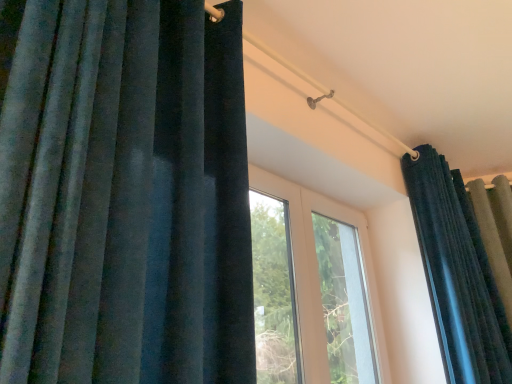
Identify the location of velvet dark blue curtain at left, which ranks as the 1th curtain in left-to-right order. (125, 196).

Image resolution: width=512 pixels, height=384 pixels. What do you see at coordinates (125, 196) in the screenshot? I see `velvet dark blue curtain at left, which is counted as the second curtain, starting from the right` at bounding box center [125, 196].

The image size is (512, 384). In order to click on transparent glass window at center in this screenshot , I will do `click(344, 303)`.

From a real-world perspective, is transparent glass window at center physically below velvet dark blue curtain at left, which is counted as the second curtain, starting from the right?

Yes, from a real-world perspective, transparent glass window at center is under velvet dark blue curtain at left, which is counted as the second curtain, starting from the right.

Which is in front, point (356, 234) or point (26, 68)?

The point (26, 68) is more forward.

Does transparent glass window at center lie in front of velvet dark blue curtain at left, which ranks as the 1th curtain in left-to-right order?

No.

Based on their sizes in the image, would you say transparent glass window at center is bigger or smaller than velvet dark blue curtain at left, arranged as the 2th curtain when viewed from the back?

In the image, transparent glass window at center appears to be smaller than velvet dark blue curtain at left, arranged as the 2th curtain when viewed from the back.

Is velvet dark blue curtain at left, which ranks as the 1th curtain in left-to-right order, positioned in front of velvet dark blue curtain at upper right, which appears as the second curtain when viewed from the front?

Yes, velvet dark blue curtain at left, which ranks as the 1th curtain in left-to-right order, is closer to the viewer.

Between velvet dark blue curtain at left, acting as the 1th curtain starting from the front, and velvet dark blue curtain at upper right, the first curtain positioned from the back, which one has more height?

With more height is velvet dark blue curtain at upper right, the first curtain positioned from the back.

From a real-world perspective, between velvet dark blue curtain at left, which is counted as the second curtain, starting from the right, and velvet dark blue curtain at upper right, which appears as the second curtain when viewed from the front, who is vertically higher?

In real-world perspective, velvet dark blue curtain at left, which is counted as the second curtain, starting from the right, is above.

Which point is more forward, (197, 64) or (506, 341)?

The point (197, 64) is more forward.

Does point (168, 26) come behind point (353, 266)?

No.

Consider the image. From the image's perspective, which one is positioned higher, velvet dark blue curtain at left, arranged as the 2th curtain when viewed from the back, or transparent glass window at center?

velvet dark blue curtain at left, arranged as the 2th curtain when viewed from the back.

Between velvet dark blue curtain at left, acting as the 1th curtain starting from the front, and transparent glass window at center, which one has less height?

transparent glass window at center.

Does velvet dark blue curtain at left, acting as the 1th curtain starting from the front, have a larger size compared to transparent glass window at center?

Yes, velvet dark blue curtain at left, acting as the 1th curtain starting from the front, is bigger than transparent glass window at center.

Which of these two, velvet dark blue curtain at upper right, the first curtain positioned from the back, or velvet dark blue curtain at left, which ranks as the 1th curtain in left-to-right order, stands shorter?

Standing shorter between the two is velvet dark blue curtain at left, which ranks as the 1th curtain in left-to-right order.

In the scene shown: Which object is thinner, velvet dark blue curtain at upper right, the first curtain positioned from the back, or velvet dark blue curtain at left, acting as the 1th curtain starting from the front?

velvet dark blue curtain at left, acting as the 1th curtain starting from the front, is thinner.

Does point (454, 213) lie behind point (9, 173)?

Yes, point (454, 213) is farther from viewer.

Identify the location of curtain that appears on the left of velvet dark blue curtain at upper right, the first curtain positioned from the back. (x=125, y=196).

Considering the positions of point (370, 376) and point (440, 182), is point (370, 376) closer or farther from the camera than point (440, 182)?

Point (370, 376) is positioned closer to the camera compared to point (440, 182).

Who is more distant, transparent glass window at center or velvet dark blue curtain at upper right, positioned as the 2th curtain in left-to-right order?

transparent glass window at center.

Visually, is transparent glass window at center positioned to the left or to the right of velvet dark blue curtain at upper right, which appears as the first curtain when viewed from the right?

From the image, it's evident that transparent glass window at center is to the left of velvet dark blue curtain at upper right, which appears as the first curtain when viewed from the right.

Considering the sizes of objects velvet dark blue curtain at upper right, which appears as the second curtain when viewed from the front, and transparent glass window at center in the image provided, who is thinner, velvet dark blue curtain at upper right, which appears as the second curtain when viewed from the front, or transparent glass window at center?

transparent glass window at center.

Locate an element on the screen. window on the left of the velvet dark blue curtain at upper right, which appears as the second curtain when viewed from the front is located at coordinates (344, 303).

Which of these two, velvet dark blue curtain at upper right, the first curtain positioned from the back, or transparent glass window at center, stands taller?

Standing taller between the two is velvet dark blue curtain at upper right, the first curtain positioned from the back.

Is velvet dark blue curtain at upper right, positioned as the 2th curtain in left-to-right order, positioned far away from transparent glass window at center?

They are positioned close to each other.

Find the location of a particular element. This screenshot has width=512, height=384. curtain that is the 2nd object located in front of the transparent glass window at center is located at coordinates (125, 196).

Identify the location of curtain lying behind the velvet dark blue curtain at left, arranged as the 2th curtain when viewed from the back. (457, 273).

From the image, which object appears to be nearer to transparent glass window at center, velvet dark blue curtain at upper right, which appears as the second curtain when viewed from the front, or velvet dark blue curtain at left, which ranks as the 1th curtain in left-to-right order?

The object closer to transparent glass window at center is velvet dark blue curtain at upper right, which appears as the second curtain when viewed from the front.

Looking at the image, which one is located further to transparent glass window at center, velvet dark blue curtain at left, which ranks as the 1th curtain in left-to-right order, or velvet dark blue curtain at upper right, the first curtain positioned from the back?

velvet dark blue curtain at left, which ranks as the 1th curtain in left-to-right order, lies further to transparent glass window at center than the other object.

When comparing their distances from velvet dark blue curtain at upper right, which appears as the second curtain when viewed from the front, does velvet dark blue curtain at left, arranged as the 2th curtain when viewed from the back, or transparent glass window at center seem further?

Among the two, velvet dark blue curtain at left, arranged as the 2th curtain when viewed from the back, is located further to velvet dark blue curtain at upper right, which appears as the second curtain when viewed from the front.

From the picture: Looking at the image, which one is located further to velvet dark blue curtain at left, which ranks as the 1th curtain in left-to-right order, velvet dark blue curtain at upper right, positioned as the 2th curtain in left-to-right order, or transparent glass window at center?

transparent glass window at center.

Considering their positions, is transparent glass window at center positioned further to velvet dark blue curtain at upper right, the first curtain positioned from the back, than velvet dark blue curtain at left, acting as the 1th curtain starting from the front?

The object further to velvet dark blue curtain at upper right, the first curtain positioned from the back, is velvet dark blue curtain at left, acting as the 1th curtain starting from the front.

Which object lies nearer to the anchor point velvet dark blue curtain at left, which is counted as the second curtain, starting from the right, transparent glass window at center or velvet dark blue curtain at upper right, which appears as the first curtain when viewed from the right?

Among the two, velvet dark blue curtain at upper right, which appears as the first curtain when viewed from the right, is located nearer to velvet dark blue curtain at left, which is counted as the second curtain, starting from the right.

I want to click on window between velvet dark blue curtain at left, which is counted as the second curtain, starting from the right, and velvet dark blue curtain at upper right, which appears as the first curtain when viewed from the right, from left to right, so click(344, 303).